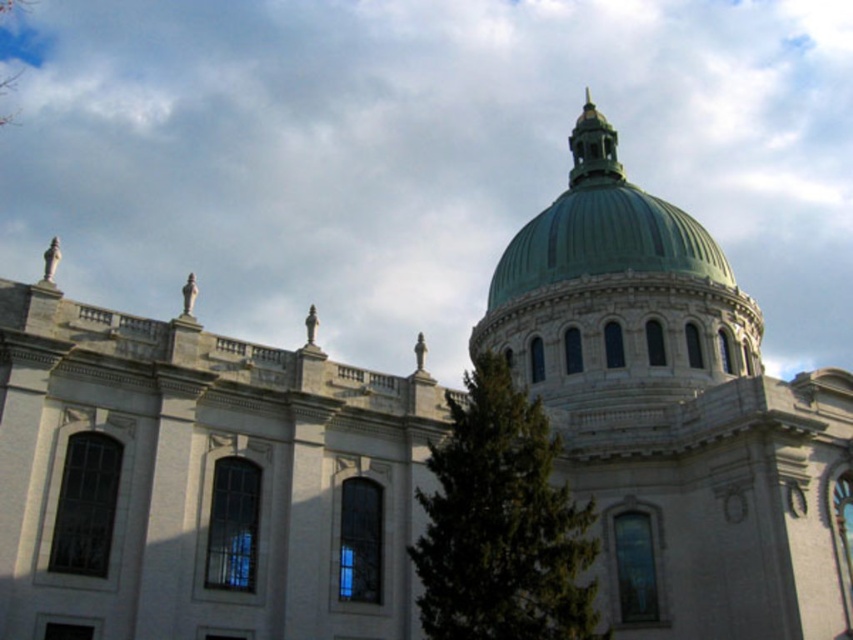
Question: Estimate the real-world distances between objects in this image. Which object is closer to the white fluffy cloud at upper center?

Choices:
 (A) green polished dome at upper center
 (B) green leafy tree at center

Answer: (A)

Question: Which point appears closest to the camera in this image?

Choices:
 (A) (583, 186)
 (B) (445, 589)
 (C) (408, 42)

Answer: (B)

Question: Does white fluffy cloud at upper center appear under green polished dome at upper center?

Choices:
 (A) no
 (B) yes

Answer: (B)

Question: Which object appears closest to the camera in this image?

Choices:
 (A) green polished dome at upper center
 (B) green leafy tree at center
 (C) white fluffy cloud at upper center

Answer: (B)

Question: Is green leafy tree at center above green polished dome at upper center?

Choices:
 (A) no
 (B) yes

Answer: (A)

Question: Can you confirm if white fluffy cloud at upper center is smaller than green polished dome at upper center?

Choices:
 (A) yes
 (B) no

Answer: (B)